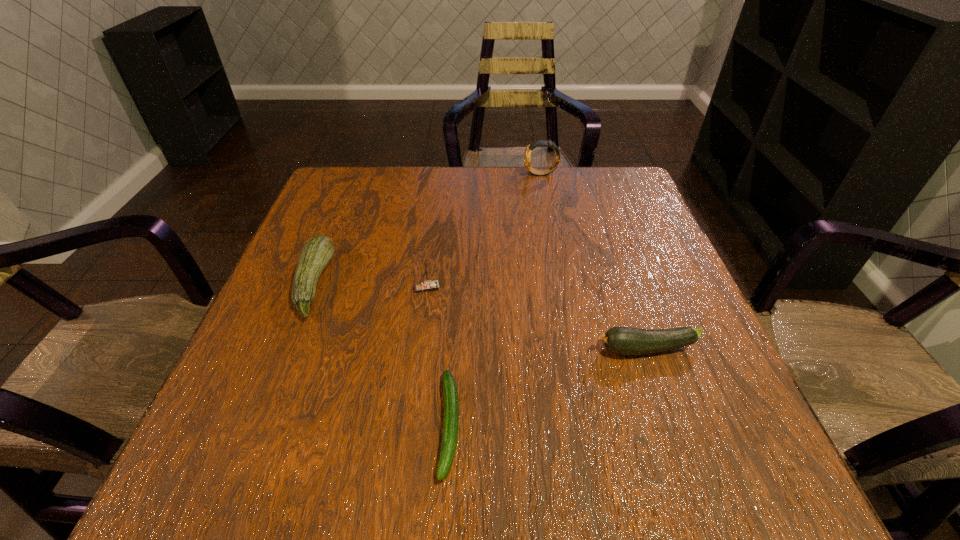
Find the location of a particular element. This screenshot has height=540, width=960. zucchini that stands as the third closest to the watch is located at coordinates (451, 401).

The image size is (960, 540). Identify the location of blank area in the image that satisfies the following two spatial constraints: 1. at the stem end of the fourth object from right to left; 2. on the right side of the tallest zucchini. (312, 287).